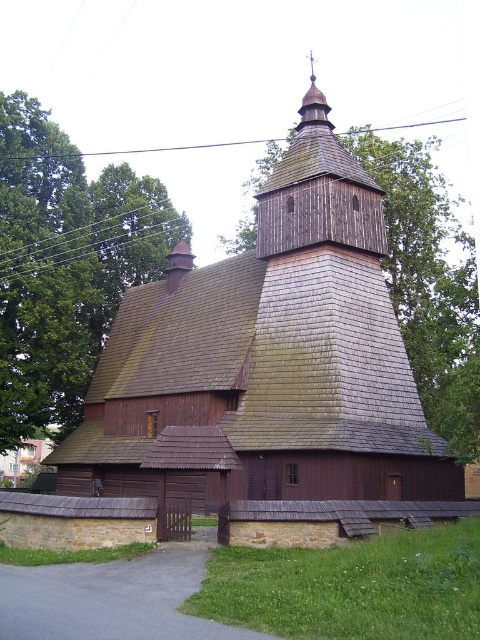
Image resolution: width=480 pixels, height=640 pixels. In order to click on dark brown wooden church at center in this screenshot , I will do `click(269, 372)`.

Who is lower down, dark brown wooden church at center or green leafy tree at upper left?

dark brown wooden church at center is lower down.

Is point (274, 193) farther from camera compared to point (96, 342)?

No, it is in front of (96, 342).

Locate an element on the screen. Image resolution: width=480 pixels, height=640 pixels. dark brown wooden church at center is located at coordinates (269, 372).

Does dark brown wooden church at center have a lesser width compared to wooden spire at upper center?

No.

Can you confirm if dark brown wooden church at center is taller than wooden spire at upper center?

No, dark brown wooden church at center is not taller than wooden spire at upper center.

Between point (395, 435) and point (299, 108), which one is positioned behind?

The point (299, 108) is behind.

Where is `dark brown wooden church at center`? Image resolution: width=480 pixels, height=640 pixels. dark brown wooden church at center is located at coordinates (269, 372).

Can you confirm if green leafy tree at upper left is taller than brown wooden roof at upper center?

No, green leafy tree at upper left is not taller than brown wooden roof at upper center.

Which of these two, green leafy tree at upper left or brown wooden roof at upper center, stands taller?

With more height is brown wooden roof at upper center.

Who is more forward, (x=158, y=204) or (x=435, y=422)?

Positioned in front is point (x=435, y=422).

Where is `green leafy tree at upper left`? The image size is (480, 640). green leafy tree at upper left is located at coordinates (64, 264).